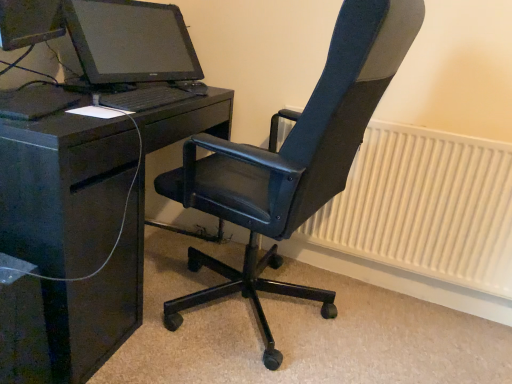
Question: Does black leather office chair at center have a larger size compared to white textured radiator at right?

Choices:
 (A) yes
 (B) no

Answer: (A)

Question: Could you tell me if black leather office chair at center is turned towards white textured radiator at right?

Choices:
 (A) yes
 (B) no

Answer: (B)

Question: Is black leather office chair at center oriented away from white textured radiator at right?

Choices:
 (A) yes
 (B) no

Answer: (B)

Question: Does black leather office chair at center appear on the right side of white textured radiator at right?

Choices:
 (A) yes
 (B) no

Answer: (B)

Question: Considering the relative sizes of black leather office chair at center and white textured radiator at right in the image provided, is black leather office chair at center shorter than white textured radiator at right?

Choices:
 (A) yes
 (B) no

Answer: (B)

Question: In terms of width, does white textured radiator at right look wider or thinner when compared to black leather office chair at center?

Choices:
 (A) wide
 (B) thin

Answer: (B)

Question: Is white textured radiator at right inside or outside of black leather office chair at center?

Choices:
 (A) outside
 (B) inside

Answer: (A)

Question: Considering the positions of white textured radiator at right and black leather office chair at center in the image, is white textured radiator at right bigger or smaller than black leather office chair at center?

Choices:
 (A) small
 (B) big

Answer: (A)

Question: Considering the positions of point (507, 240) and point (269, 334), is point (507, 240) closer or farther from the camera than point (269, 334)?

Choices:
 (A) closer
 (B) farther

Answer: (B)

Question: From the image's perspective, is black matte keyboard at center above or below black glossy desk at left?

Choices:
 (A) above
 (B) below

Answer: (A)

Question: Does point (134, 110) appear closer or farther from the camera than point (14, 119)?

Choices:
 (A) farther
 (B) closer

Answer: (A)

Question: Considering the positions of black matte keyboard at center and black glossy desk at left in the image, is black matte keyboard at center taller or shorter than black glossy desk at left?

Choices:
 (A) short
 (B) tall

Answer: (A)

Question: Do you think black matte keyboard at center is within black glossy desk at left, or outside of it?

Choices:
 (A) outside
 (B) inside

Answer: (A)

Question: Relative to matte black monitor at upper left, is white textured radiator at right in front or behind?

Choices:
 (A) behind
 (B) front

Answer: (A)

Question: Looking at their shapes, would you say white textured radiator at right is wider or thinner than matte black monitor at upper left?

Choices:
 (A) thin
 (B) wide

Answer: (A)